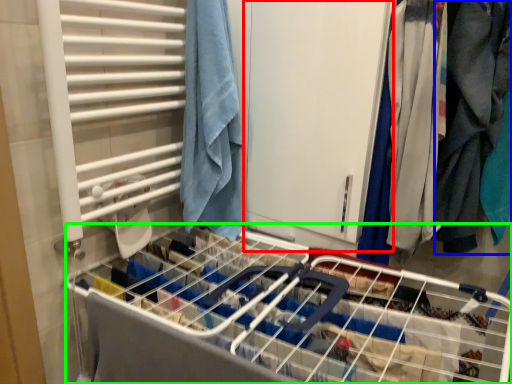
Question: Based on their relative distances, which object is farther from screen door (highlighted by a red box)? Choose from clothing (highlighted by a blue box) and bed frame (highlighted by a green box).

Choices:
 (A) clothing
 (B) bed frame

Answer: (B)